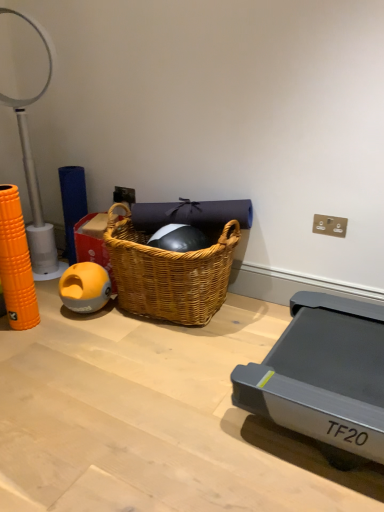
The width and height of the screenshot is (384, 512). In order to click on vacant space to the left of yellow rubber ball at left in this screenshot , I will do pos(52,311).